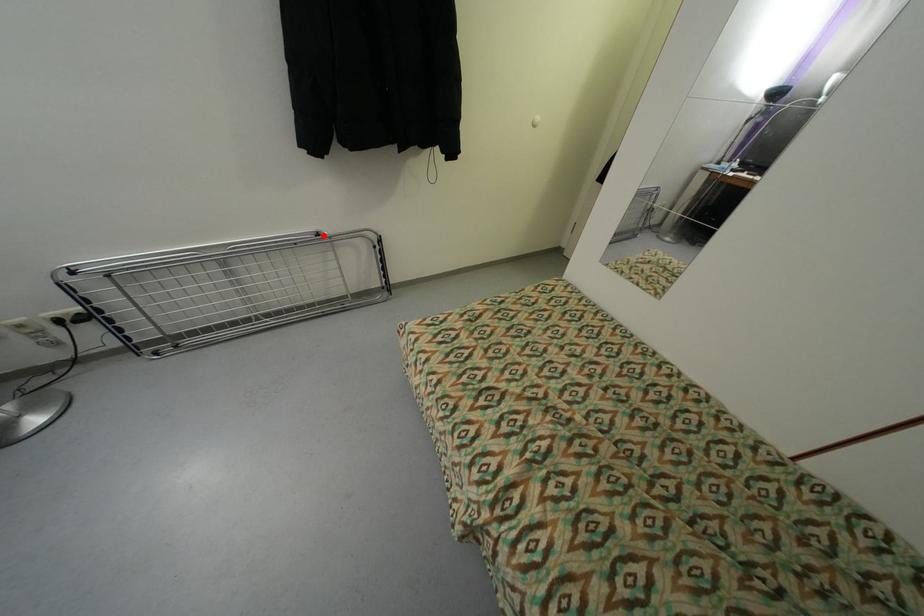
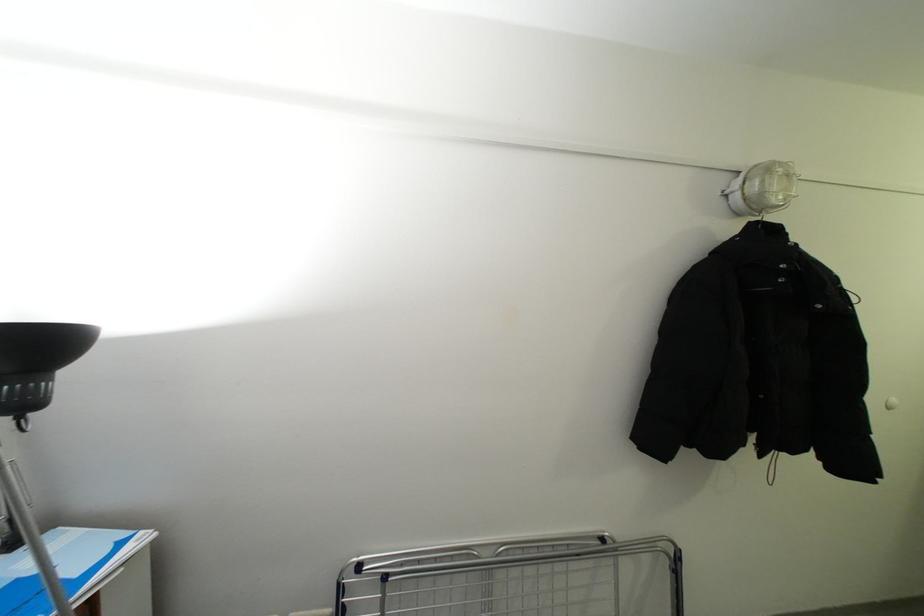
Find the pixel in the second image that matches the highlighted location in the first image.

(609, 541)